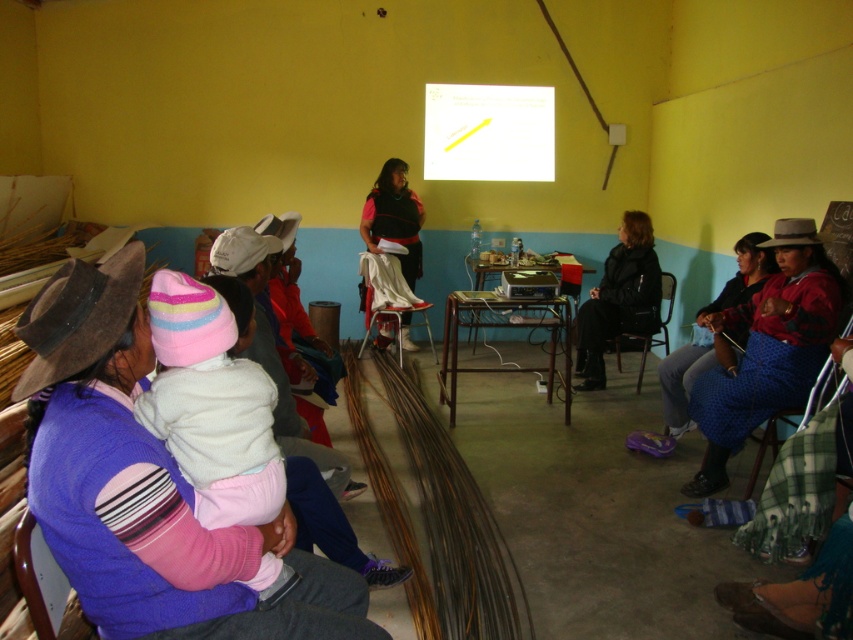
Question: Which object is positioned farthest from the polka dot fabric at lower right?

Choices:
 (A) white cotton cowboy hat at lower left
 (B) brown felt cowboy hat at left
 (C) wooden chair at lower left

Answer: (C)

Question: Is blue woven skirt at lower right above metallic black chair at center?

Choices:
 (A) yes
 (B) no

Answer: (B)

Question: Can you confirm if black leather jacket at center is positioned to the left of metallic silver chair at center?

Choices:
 (A) yes
 (B) no

Answer: (B)

Question: Which object is closer to the camera taking this photo?

Choices:
 (A) metallic black chair at center
 (B) metallic silver chair at center

Answer: (A)

Question: Does polka dot fabric at lower right appear over wooden chair at lower left?

Choices:
 (A) no
 (B) yes

Answer: (B)

Question: Which point is farther to the camera?

Choices:
 (A) (27, 586)
 (B) (112, 412)
 (C) (724, 349)
 (D) (80, 355)

Answer: (C)